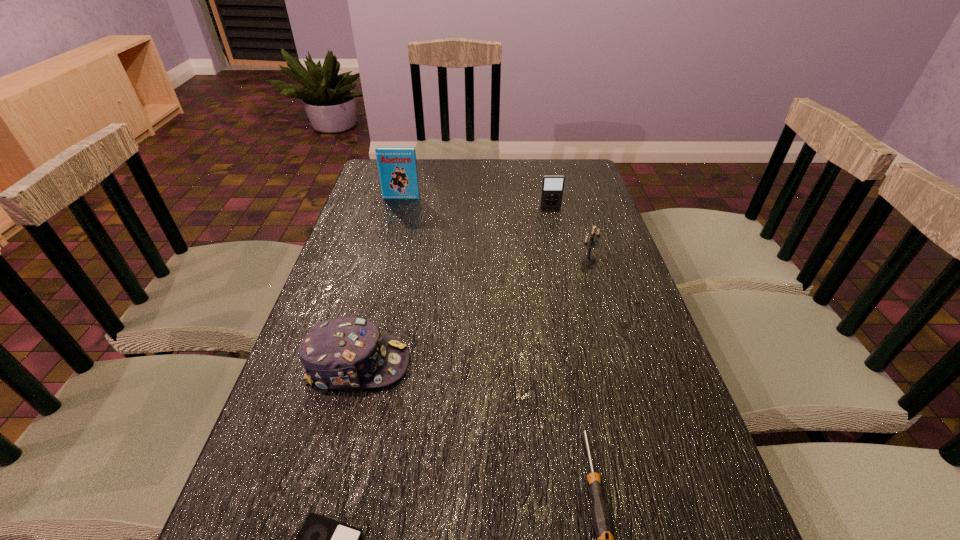
Locate an element on the screen. The image size is (960, 540). vacant space situated on the front-facing side of the headwear is located at coordinates (505, 364).

The image size is (960, 540). In order to click on book at the left edge in this screenshot , I will do `click(397, 166)`.

In order to click on headwear that is at the left edge in this screenshot , I will do `click(345, 352)`.

Locate an element on the screen. candle holder located in the right edge section of the desktop is located at coordinates (591, 243).

Image resolution: width=960 pixels, height=540 pixels. In order to click on iPod that is positioned at the right edge in this screenshot , I will do `click(552, 185)`.

Where is `free space at the far edge`? free space at the far edge is located at coordinates (504, 163).

The height and width of the screenshot is (540, 960). In order to click on vacant space at the left edge of the desktop in this screenshot , I will do `click(244, 500)`.

Where is `vacant space at the right edge of the desktop`? Image resolution: width=960 pixels, height=540 pixels. vacant space at the right edge of the desktop is located at coordinates (564, 194).

The height and width of the screenshot is (540, 960). In the image, there is a desktop. Find the location of `vacant space at the far left corner`. vacant space at the far left corner is located at coordinates (375, 182).

The image size is (960, 540). In the image, there is a desktop. In order to click on free space at the far right corner in this screenshot , I will do `click(569, 170)`.